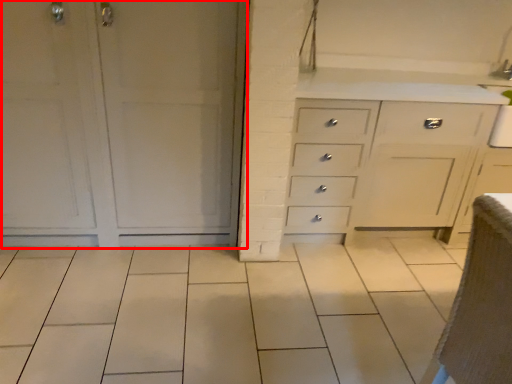
Question: Observing the image, what is the correct spatial positioning of door (annotated by the red box) in reference to armchair?

Choices:
 (A) right
 (B) left

Answer: (B)